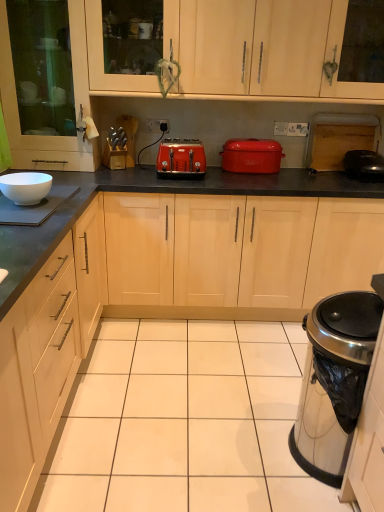
Question: Are satin silver trash can at lower right, positioned as the 2th appliance in left-to-right order, and white glossy bowl at left, placed as the 2th appliance when sorted from top to bottom, beside each other?

Choices:
 (A) no
 (B) yes

Answer: (A)

Question: Is satin silver trash can at lower right, the 3th appliance in the top-to-bottom sequence, outside of white glossy bowl at left, the 2th appliance ordered from the bottom?

Choices:
 (A) yes
 (B) no

Answer: (A)

Question: From the image's perspective, is satin silver trash can at lower right, positioned as the 2th appliance in left-to-right order, below white glossy bowl at left, arranged as the 2th appliance when viewed from the front?

Choices:
 (A) yes
 (B) no

Answer: (A)

Question: Is satin silver trash can at lower right, the first appliance from the bottom, bigger than white glossy bowl at left, the 2th appliance positioned from the back?

Choices:
 (A) yes
 (B) no

Answer: (A)

Question: Is satin silver trash can at lower right, positioned as the 2th appliance in left-to-right order, closer to the viewer compared to white glossy bowl at left, the 1th appliance from the left?

Choices:
 (A) no
 (B) yes

Answer: (B)

Question: Considering the positions of black glossy pan at right, arranged as the 3th appliance when viewed from the left, and light wood cabinet at upper center, which is counted as the 1th cabinetry, starting from the right, in the image, is black glossy pan at right, arranged as the 3th appliance when viewed from the left, bigger or smaller than light wood cabinet at upper center, which is counted as the 1th cabinetry, starting from the right,?

Choices:
 (A) small
 (B) big

Answer: (A)

Question: Is point (380, 167) closer or farther from the camera than point (281, 62)?

Choices:
 (A) closer
 (B) farther

Answer: (B)

Question: From the image's perspective, is black glossy pan at right, which is the third appliance in bottom-to-top order, above or below light wood cabinet at upper center, which is counted as the 1th cabinetry, starting from the right?

Choices:
 (A) below
 (B) above

Answer: (A)

Question: In the image, is black glossy pan at right, placed as the first appliance when sorted from top to bottom, on the left side or the right side of light wood cabinet at upper center, which is counted as the 1th cabinetry, starting from the right?

Choices:
 (A) left
 (B) right

Answer: (B)

Question: Relative to white plastic electric outlet at center, is matte wood cabinet at left, positioned as the 1th cabinetry in left-to-right order, in front or behind?

Choices:
 (A) front
 (B) behind

Answer: (A)

Question: Based on their sizes in the image, would you say matte wood cabinet at left, marked as the second cabinetry in a right-to-left arrangement, is bigger or smaller than white plastic electric outlet at center?

Choices:
 (A) big
 (B) small

Answer: (A)

Question: Looking at their shapes, would you say matte wood cabinet at left, marked as the second cabinetry in a right-to-left arrangement, is wider or thinner than white plastic electric outlet at center?

Choices:
 (A) wide
 (B) thin

Answer: (A)

Question: Based on their positions, is matte wood cabinet at left, positioned as the 1th cabinetry in left-to-right order, located to the left or right of white plastic electric outlet at center?

Choices:
 (A) left
 (B) right

Answer: (A)

Question: Is point (198, 173) closer or farther from the camera than point (31, 210)?

Choices:
 (A) farther
 (B) closer

Answer: (A)

Question: In terms of size, does orange matte toaster at center appear bigger or smaller than white glossy bowl at left, the 2th appliance positioned from the back?

Choices:
 (A) big
 (B) small

Answer: (A)